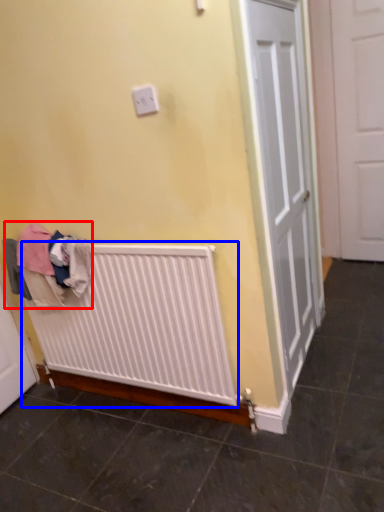
Question: Which point is further to the camera, clothing (highlighted by a red box) or radiator (highlighted by a blue box)?

Choices:
 (A) clothing
 (B) radiator

Answer: (A)